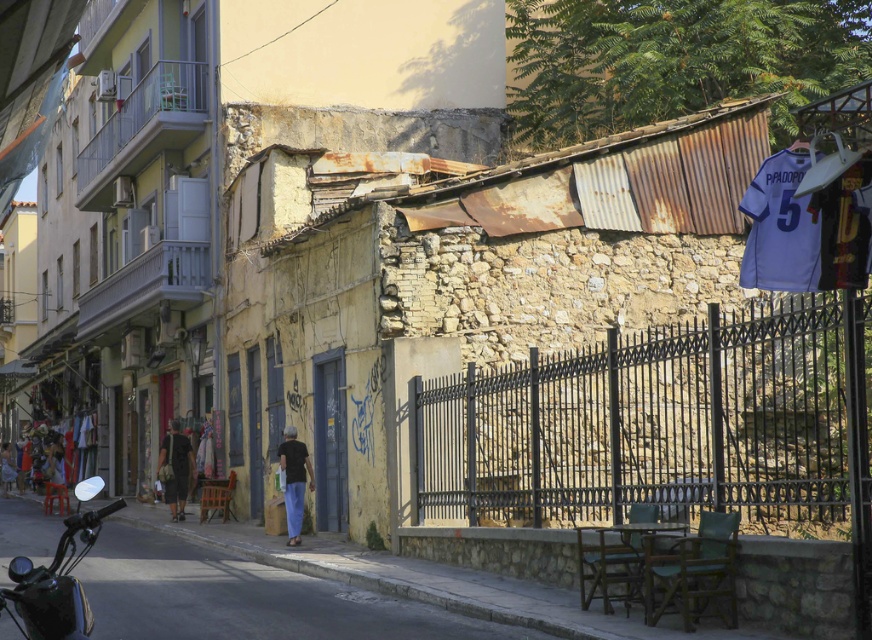
Question: Estimate the real-world distances between objects in this image. Which object is farther from the dark brown leather jacket at lower left?

Choices:
 (A) shiny black motorcycle at lower left
 (B) black matte shirt at center

Answer: (B)

Question: Which point is farther from the camera taking this photo?

Choices:
 (A) (184, 438)
 (B) (283, 445)
 (C) (79, 612)

Answer: (A)

Question: Is black matte shirt at center smaller than dark brown leather jacket at lower left?

Choices:
 (A) yes
 (B) no

Answer: (A)

Question: Is black matte shirt at center smaller than dark brown leather jacket at lower left?

Choices:
 (A) yes
 (B) no

Answer: (A)

Question: Which point appears closest to the camera in this image?

Choices:
 (A) (52, 634)
 (B) (169, 449)
 (C) (281, 458)

Answer: (A)

Question: Does shiny black motorcycle at lower left appear over dark brown leather jacket at lower left?

Choices:
 (A) yes
 (B) no

Answer: (B)